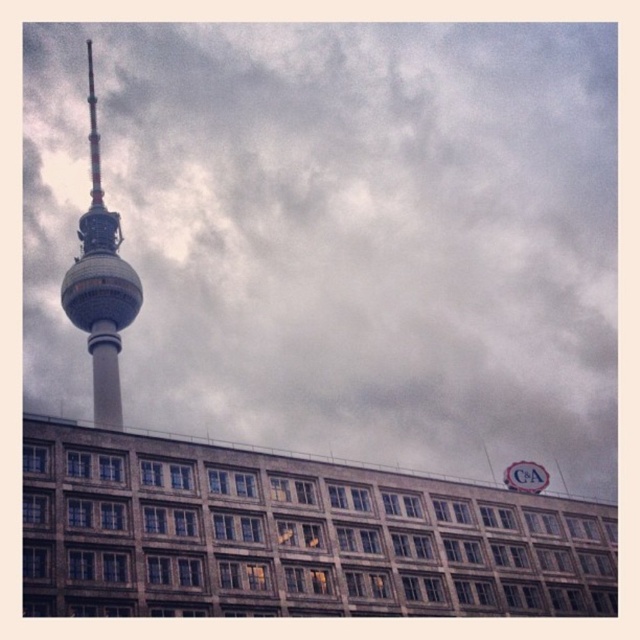
Between cloudy gray sky at upper center and metallic silver tower at left, which one is positioned lower?

metallic silver tower at left is below.

How much distance is there between cloudy gray sky at upper center and metallic silver tower at left?

A distance of 72.69 meters exists between cloudy gray sky at upper center and metallic silver tower at left.

Does point (572, 417) come closer to viewer compared to point (106, 426)?

No, it is not.

Identify the location of cloudy gray sky at upper center. (340, 234).